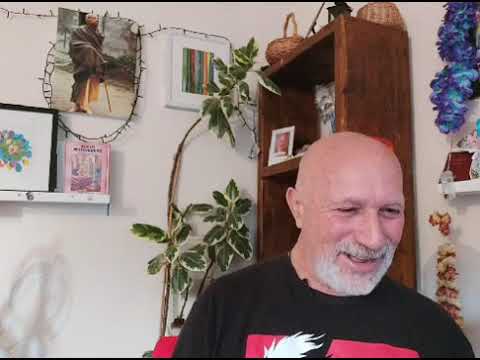
Identify the location of baskets. The height and width of the screenshot is (360, 480). (276, 43), (380, 17).